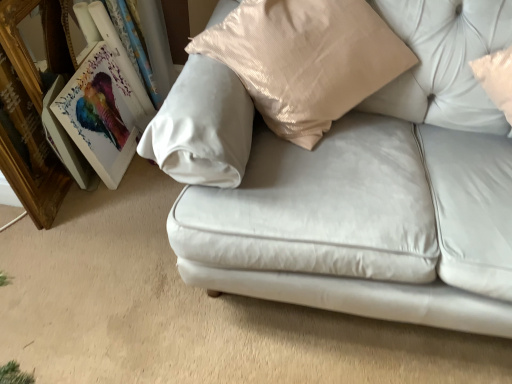
Question: Is satin white couch at center completely or partially outside of matte wooden picture frame at left, which ranks as the 2th picture frame in left-to-right order?

Choices:
 (A) yes
 (B) no

Answer: (A)

Question: Can matte wooden picture frame at left, which ranks as the 2th picture frame in left-to-right order, be found inside satin white couch at center?

Choices:
 (A) yes
 (B) no

Answer: (B)

Question: From the image's perspective, is satin white couch at center on top of matte wooden picture frame at left, which is the first picture frame from right to left?

Choices:
 (A) yes
 (B) no

Answer: (A)

Question: Is satin white couch at center at the left side of matte wooden picture frame at left, which ranks as the 2th picture frame in left-to-right order?

Choices:
 (A) no
 (B) yes

Answer: (A)

Question: Can you confirm if satin white couch at center is thinner than matte wooden picture frame at left, which ranks as the 2th picture frame in left-to-right order?

Choices:
 (A) yes
 (B) no

Answer: (B)

Question: Is satin white couch at center behind matte wooden picture frame at left, which ranks as the 2th picture frame in left-to-right order?

Choices:
 (A) no
 (B) yes

Answer: (A)

Question: Considering the relative positions of matte wooden picture frame at left, which is the first picture frame from right to left, and satin white couch at center in the image provided, is matte wooden picture frame at left, which is the first picture frame from right to left, behind satin white couch at center?

Choices:
 (A) yes
 (B) no

Answer: (A)

Question: Does matte wooden picture frame at left, which ranks as the 2th picture frame in left-to-right order, have a lesser width compared to satin white couch at center?

Choices:
 (A) yes
 (B) no

Answer: (A)

Question: Is matte wooden picture frame at left, which is the first picture frame from right to left, facing towards satin white couch at center?

Choices:
 (A) no
 (B) yes

Answer: (B)

Question: Considering the relative positions of matte wooden picture frame at left, which ranks as the 2th picture frame in left-to-right order, and satin white couch at center in the image provided, is matte wooden picture frame at left, which ranks as the 2th picture frame in left-to-right order, to the left of satin white couch at center from the viewer's perspective?

Choices:
 (A) yes
 (B) no

Answer: (A)

Question: Is matte wooden picture frame at left, which is the first picture frame from right to left, smaller than satin white couch at center?

Choices:
 (A) no
 (B) yes

Answer: (B)

Question: Can we say matte wooden picture frame at left, which is the first picture frame from right to left, lies outside satin white couch at center?

Choices:
 (A) yes
 (B) no

Answer: (A)

Question: Considering the relative sizes of wooden gold picture frame at left, the 2th picture frame when ordered from right to left, and satin white couch at center in the image provided, is wooden gold picture frame at left, the 2th picture frame when ordered from right to left, taller than satin white couch at center?

Choices:
 (A) no
 (B) yes

Answer: (B)